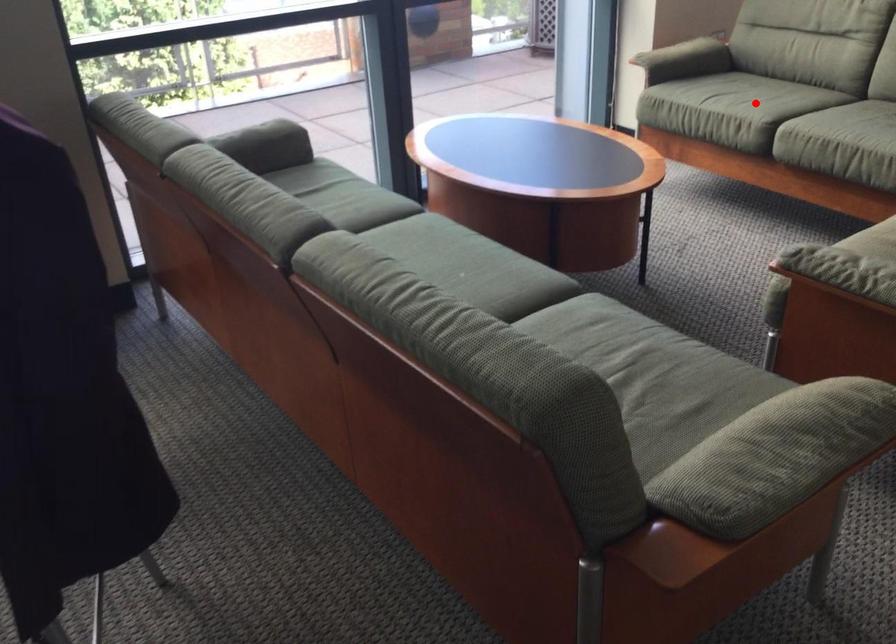
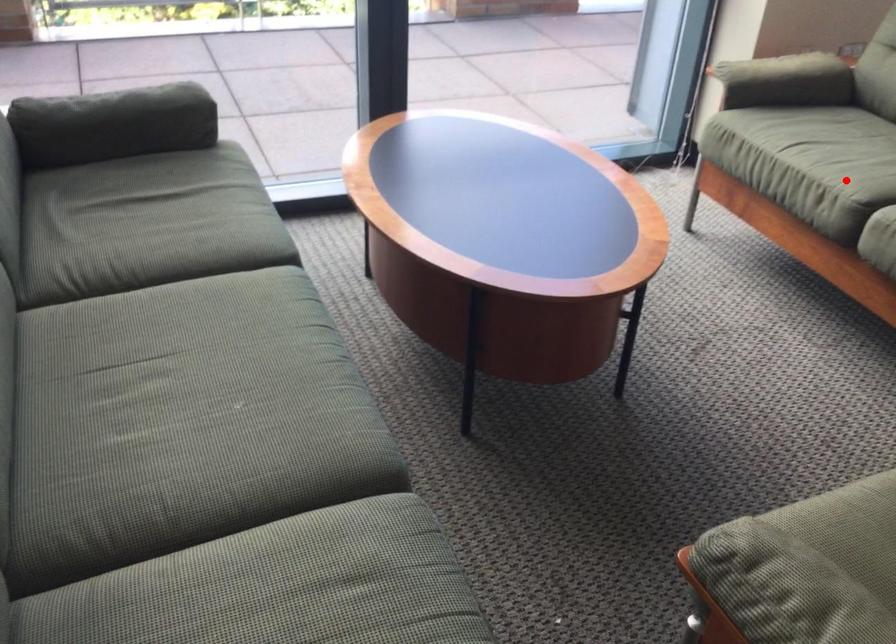
I am providing you with two images of the same scene from different viewpoints. A red point is marked on the first image and another point is marked on the second image. Do the highlighted points in image1 and image2 indicate the same real-world spot?

Yes